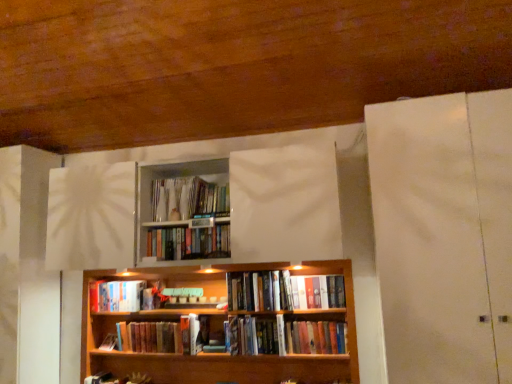
What is the approximate height of hardcover books at center, the sixth book from the top?

hardcover books at center, the sixth book from the top, is 9.71 inches tall.

Locate an element on the screen. The image size is (512, 384). white matte door at right is located at coordinates (444, 235).

Consider the image. What is the approximate height of wooden bookcase at center?

32.67 inches.

Image resolution: width=512 pixels, height=384 pixels. What do you see at coordinates (188, 243) in the screenshot? I see `hardcover books at center, the 6th book positioned from the bottom` at bounding box center [188, 243].

Image resolution: width=512 pixels, height=384 pixels. In order to click on hardcover book at center, acting as the first book starting from the bottom in this screenshot , I will do `click(159, 336)`.

From a real-world perspective, starting from the hardcover books at center, which ranks as the fourth book in bottom-to-top order, which book is the 1st one vertically above it? Please provide its 2D coordinates.

[(188, 243)]

Is hardcover books at center, which ranks as the fourth book in bottom-to-top order, with hardcover books at center, the 6th book positioned from the bottom?

No, hardcover books at center, which ranks as the fourth book in bottom-to-top order, is not making contact with hardcover books at center, the 6th book positioned from the bottom.

Considering the relative sizes of hardcover books at center, which is counted as the fourth book, starting from the top, and hardcover books at center, which is the second book from top to bottom, in the image provided, is hardcover books at center, which is counted as the fourth book, starting from the top, wider than hardcover books at center, which is the second book from top to bottom,?

Yes.

Is hardcover books at center, which ranks as the fourth book in bottom-to-top order, to the left of hardcover books at center, which is the second book from top to bottom, from the viewer's perspective?

Incorrect, hardcover books at center, which ranks as the fourth book in bottom-to-top order, is not on the left side of hardcover books at center, which is the second book from top to bottom.

Considering the positions of points (336, 281) and (232, 280), is point (336, 281) farther from camera compared to point (232, 280)?

That is False.

Is hardcover books at center, which ranks as the fourth book in bottom-to-top order, completely or partially inside hardcover book at center, acting as the 5th book starting from the bottom?

Actually, hardcover books at center, which ranks as the fourth book in bottom-to-top order, is outside hardcover book at center, acting as the 5th book starting from the bottom.

Considering their positions, is hardcover book at center, the 3th book from the top, located in front of or behind hardcover books at center, which ranks as the fourth book in bottom-to-top order?

hardcover book at center, the 3th book from the top, is in front of hardcover books at center, which ranks as the fourth book in bottom-to-top order.

In terms of size, does hardcover books at center, which is the second book from top to bottom, appear bigger or smaller than hardcover books at center, the sixth book from the top?

hardcover books at center, which is the second book from top to bottom, is smaller than hardcover books at center, the sixth book from the top.

How different are the orientations of hardcover books at center, which is the second book from top to bottom, and hardcover books at center, which is the second book in bottom-to-top order, in degrees?

The angular difference between hardcover books at center, which is the second book from top to bottom, and hardcover books at center, which is the second book in bottom-to-top order, is 0.000811 degrees.

Is hardcover books at center, which is the second book from top to bottom, to the right of hardcover books at center, the sixth book from the top, from the viewer's perspective?

No.

Which point is more distant from viewer, (147, 239) or (300, 329)?

The point (300, 329) is farther.

Between hardcover books at center, which is counted as the fourth book, starting from the top, and hardcover book at center, positioned as the 3th book in bottom-to-top order, which one has larger size?

hardcover books at center, which is counted as the fourth book, starting from the top.

Visually, is hardcover books at center, which ranks as the fourth book in bottom-to-top order, positioned to the left or to the right of hardcover book at center, positioned as the 3th book in bottom-to-top order?

hardcover books at center, which ranks as the fourth book in bottom-to-top order, is positioned on hardcover book at center, positioned as the 3th book in bottom-to-top order,'s right side.

Is hardcover books at center, which ranks as the fourth book in bottom-to-top order, situated inside hardcover book at center, arranged as the 5th book when viewed from the top, or outside?

hardcover books at center, which ranks as the fourth book in bottom-to-top order, cannot be found inside hardcover book at center, arranged as the 5th book when viewed from the top.

Could you measure the distance between hardcover books at center, which is counted as the fourth book, starting from the top, and hardcover book at center, positioned as the 3th book in bottom-to-top order?

37.93 inches.

Could you tell me if hardcover book at center, positioned as the 3th book in bottom-to-top order, is turned towards hardcover book at center, the 3th book from the top?

No, hardcover book at center, positioned as the 3th book in bottom-to-top order, is not turned towards hardcover book at center, the 3th book from the top.

From a real-world perspective, relative to hardcover book at center, the 3th book from the top, is hardcover book at center, arranged as the 5th book when viewed from the top, vertically above or below?

hardcover book at center, arranged as the 5th book when viewed from the top, is situated higher than hardcover book at center, the 3th book from the top, in the real world.

Which object is thinner, hardcover book at center, arranged as the 5th book when viewed from the top, or hardcover book at center, acting as the 5th book starting from the bottom?

hardcover book at center, acting as the 5th book starting from the bottom, is thinner.

Is hardcover book at center, arranged as the 5th book when viewed from the top, in front of or behind hardcover book at center, acting as the 5th book starting from the bottom, in the image?

In the image, hardcover book at center, arranged as the 5th book when viewed from the top, appears behind hardcover book at center, acting as the 5th book starting from the bottom.

How different are the orientations of wooden bookcase at center and white matte door at right in degrees?

The facing directions of wooden bookcase at center and white matte door at right are 0.0863 degrees apart.

Looking at this image, which of these two, wooden bookcase at center or white matte door at right, is smaller?

wooden bookcase at center.

The width and height of the screenshot is (512, 384). In order to click on bookcase located on the left of white matte door at right in this screenshot , I will do [223, 327].

Which is behind, hardcover books at center, which is the second book from top to bottom, or hardcover books at center, which ranks as the fourth book in bottom-to-top order?

hardcover books at center, which ranks as the fourth book in bottom-to-top order, is further away from the camera.

Is hardcover books at center, which is counted as the fourth book, starting from the top, a part of hardcover books at center, which is the second book from top to bottom?

No.

Is hardcover books at center, which is the second book from top to bottom, facing away from hardcover books at center, which is counted as the fourth book, starting from the top?

That's not correct — hardcover books at center, which is the second book from top to bottom, is not looking away from hardcover books at center, which is counted as the fourth book, starting from the top.

Between hardcover books at center, which is the second book from top to bottom, and hardcover books at center, which is counted as the fourth book, starting from the top, which one has larger width?

hardcover books at center, which is counted as the fourth book, starting from the top, is wider.

You are a GUI agent. You are given a task and a screenshot of the screen. Output one action in this format:
    pyautogui.click(x=<x>, y=<y>)
    Task: Click on the book that is the 4th one when counting forward from the hardcover books at center, which is counted as the fourth book, starting from the top
    The width and height of the screenshot is (512, 384).
    Given the screenshot: What is the action you would take?
    pyautogui.click(x=188, y=243)

This screenshot has width=512, height=384. There is a hardcover books at center, which ranks as the fourth book in bottom-to-top order. What are the coordinates of `the 2nd book below it (from a real-world perspective)` in the screenshot? It's located at (318, 292).

Based on their spatial positions, is wooden bookcase at center or white matte door at right further from hardcover books at center, which is counted as the fourth book, starting from the top?

Based on the image, white matte door at right appears to be further to hardcover books at center, which is counted as the fourth book, starting from the top.

Considering their positions, is hardcover book at center, acting as the first book starting from the bottom, positioned closer to hardcover books at center, which is the second book from top to bottom, than hardcover books at center, the sixth book from the top?

Among the two, hardcover book at center, acting as the first book starting from the bottom, is located nearer to hardcover books at center, which is the second book from top to bottom.

From the image, which object appears to be nearer to wooden bookcase at center, hardcover books at center, the sixth book from the top, or hardcover books at center, which is the second book from top to bottom?

The object closer to wooden bookcase at center is hardcover books at center, the sixth book from the top.

Considering their positions, is hardcover books at center, the 6th book positioned from the bottom, positioned closer to hardcover books at center, the sixth book from the top, than wooden bookcase at center?

Based on the image, wooden bookcase at center appears to be nearer to hardcover books at center, the sixth book from the top.

When comparing their distances from white matte door at right, does hardcover book at center, positioned as the 3th book in bottom-to-top order, or matte plastic books at upper center, which is the 1th book in top-to-bottom order, seem closer?

matte plastic books at upper center, which is the 1th book in top-to-bottom order, lies closer to white matte door at right than the other object.

Considering their positions, is hardcover books at center, the sixth book from the top, positioned closer to matte plastic books at upper center, which is the 1th book in top-to-bottom order, than wooden bookcase at center?

wooden bookcase at center is closer to matte plastic books at upper center, which is the 1th book in top-to-bottom order.

Based on their spatial positions, is wooden bookcase at center or hardcover book at center, arranged as the 5th book when viewed from the top, further from hardcover book at center, acting as the 5th book starting from the bottom?

hardcover book at center, arranged as the 5th book when viewed from the top.

Which object lies nearer to the anchor point hardcover book at center, acting as the first book starting from the bottom, hardcover book at center, the 3th book from the top, or matte plastic books at upper center, placed as the 7th book when sorted from bottom to top?

matte plastic books at upper center, placed as the 7th book when sorted from bottom to top, is positioned closer to the anchor hardcover book at center, acting as the first book starting from the bottom.

The width and height of the screenshot is (512, 384). Identify the location of book located between hardcover books at center, the sixth book from the top, and white matte door at right in the left-right direction. (318, 292).

The height and width of the screenshot is (384, 512). What are the coordinates of `book between hardcover books at center, which ranks as the fourth book in bottom-to-top order, and hardcover book at center, the 3th book from the top` in the screenshot? It's located at (283, 336).

The height and width of the screenshot is (384, 512). I want to click on bookcase between hardcover book at center, positioned as the 3th book in bottom-to-top order, and white matte door at right from left to right, so click(x=223, y=327).

Where is `book located between hardcover books at center, the 6th book positioned from the bottom, and hardcover books at center, the sixth book from the top, in the left-right direction`? book located between hardcover books at center, the 6th book positioned from the bottom, and hardcover books at center, the sixth book from the top, in the left-right direction is located at coordinates (283, 291).